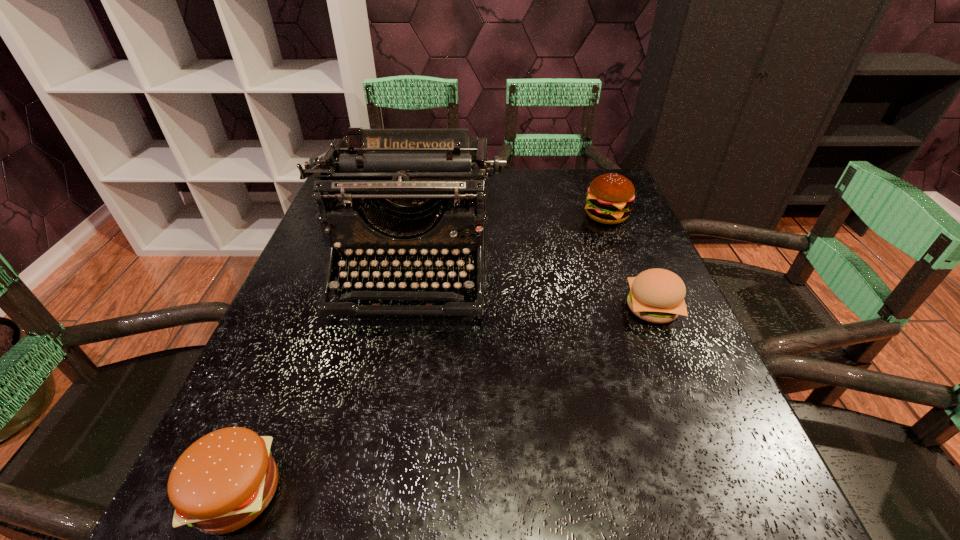
Find the location of a particular element. The height and width of the screenshot is (540, 960). free region at the left edge of the desktop is located at coordinates (296, 296).

I want to click on free spot at the right edge of the desktop, so click(x=586, y=244).

You are a GUI agent. You are given a task and a screenshot of the screen. Output one action in this format:
    pyautogui.click(x=<x>, y=<y>)
    Task: Click on the vacant space at the far right corner of the desktop
    This screenshot has height=540, width=960.
    Given the screenshot: What is the action you would take?
    pyautogui.click(x=591, y=179)

What are the coordinates of `free space at the near right corner of the desktop` in the screenshot? It's located at (771, 493).

This screenshot has height=540, width=960. I want to click on empty location between the farthest hamburger and the second nearest hamburger, so click(629, 262).

Identify the location of unoccupied position between the farthest hamburger and the typewriter. The image size is (960, 540). (509, 242).

The width and height of the screenshot is (960, 540). I want to click on free space that is in between the tallest hamburger and the tallest object, so click(509, 242).

Where is `empty location between the third shortest object and the second farthest hamburger`? empty location between the third shortest object and the second farthest hamburger is located at coordinates (629, 262).

The height and width of the screenshot is (540, 960). I want to click on free space between the tallest hamburger and the second farthest hamburger, so click(x=629, y=262).

This screenshot has width=960, height=540. Identify the location of object that stands as the second closest to the farthest hamburger. (656, 295).